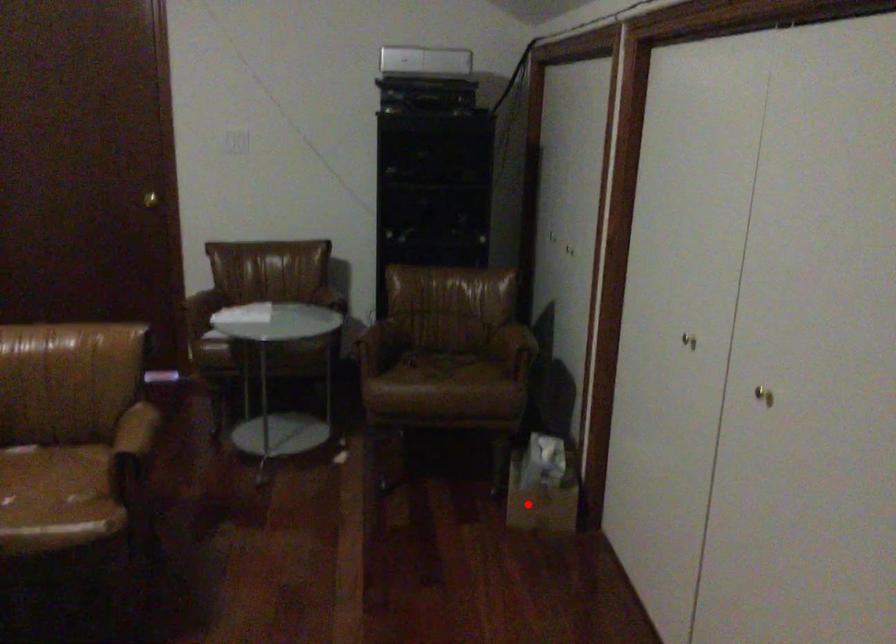
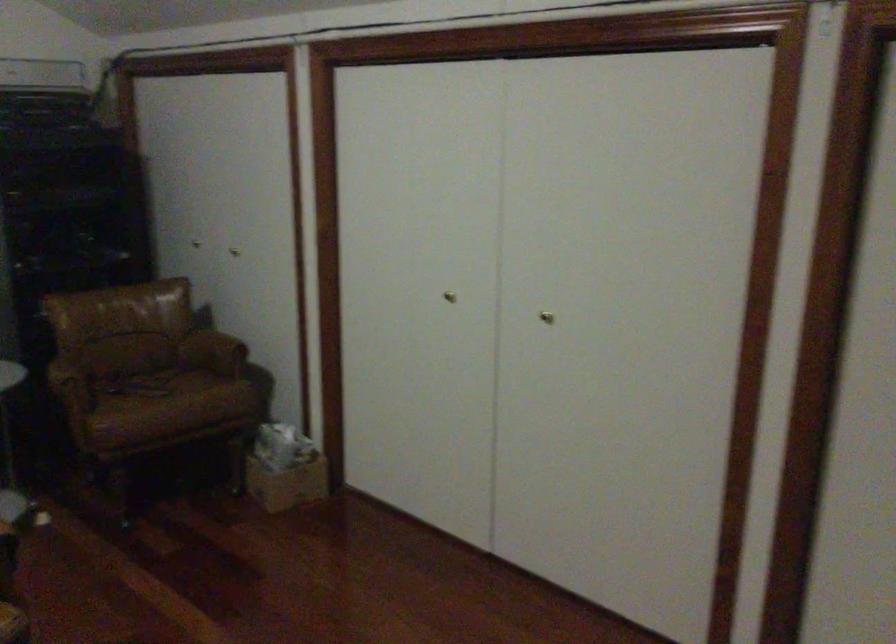
The point at the highlighted location is marked in the first image. Where is the corresponding point in the second image?

(287, 484)